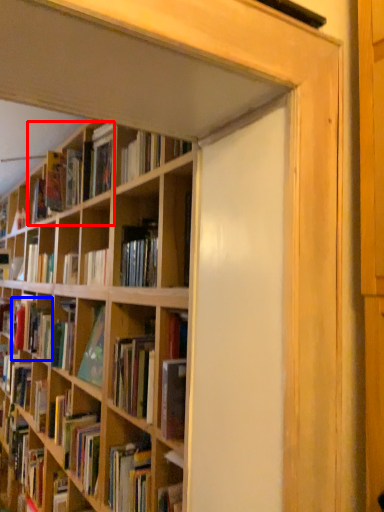
Question: Among these objects, which one is nearest to the camera, book (highlighted by a red box) or book (highlighted by a blue box)?

Choices:
 (A) book
 (B) book

Answer: (A)